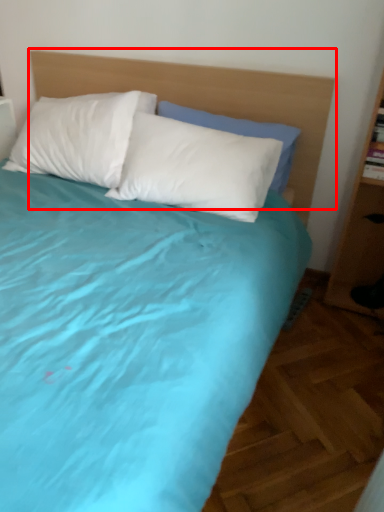
Question: Observing the image, what is the correct spatial positioning of headboard (annotated by the red box) in reference to pillow?

Choices:
 (A) right
 (B) left

Answer: (B)